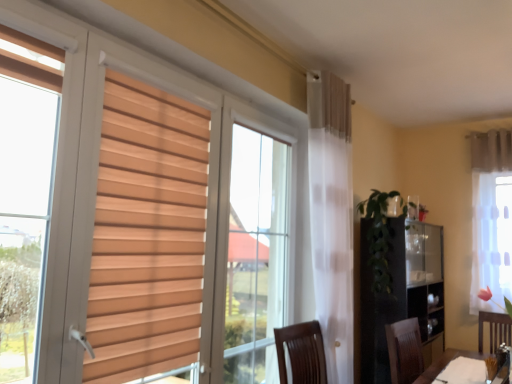
Question: Is green leafy plant at center-right outside white sheer curtain at right, marked as the second curtain in a top-to-bottom arrangement?

Choices:
 (A) yes
 (B) no

Answer: (A)

Question: Is green leafy plant at center-right surrounding white sheer curtain at right, acting as the 1th curtain starting from the bottom?

Choices:
 (A) no
 (B) yes

Answer: (A)

Question: Considering the relative positions of green leafy plant at center-right and white sheer curtain at right, marked as the second curtain in a top-to-bottom arrangement, in the image provided, is green leafy plant at center-right to the left of white sheer curtain at right, marked as the second curtain in a top-to-bottom arrangement, from the viewer's perspective?

Choices:
 (A) no
 (B) yes

Answer: (B)

Question: Is green leafy plant at center-right at the right side of white sheer curtain at right, marked as the second curtain in a top-to-bottom arrangement?

Choices:
 (A) yes
 (B) no

Answer: (B)

Question: Is green leafy plant at center-right far away from white sheer curtain at right, marked as the second curtain in a top-to-bottom arrangement?

Choices:
 (A) no
 (B) yes

Answer: (B)

Question: Does green leafy plant at center-right turn towards white sheer curtain at right, acting as the 1th curtain starting from the bottom?

Choices:
 (A) no
 (B) yes

Answer: (A)

Question: Does white sheer curtain at right, marked as the second curtain in a top-to-bottom arrangement, appear on the left side of white sheer curtain at upper right, positioned as the first curtain in top-to-bottom order?

Choices:
 (A) yes
 (B) no

Answer: (A)

Question: Is white sheer curtain at right, marked as the second curtain in a top-to-bottom arrangement, shorter than white sheer curtain at upper right, the 2th curtain ordered from the bottom?

Choices:
 (A) no
 (B) yes

Answer: (A)

Question: Can you confirm if white sheer curtain at right, acting as the 1th curtain starting from the bottom, is smaller than white sheer curtain at upper right, positioned as the first curtain in top-to-bottom order?

Choices:
 (A) yes
 (B) no

Answer: (B)

Question: Can you confirm if white sheer curtain at right, acting as the 1th curtain starting from the bottom, is bigger than white sheer curtain at upper right, positioned as the first curtain in top-to-bottom order?

Choices:
 (A) yes
 (B) no

Answer: (A)

Question: Can you confirm if white sheer curtain at right, acting as the 1th curtain starting from the bottom, is thinner than white sheer curtain at upper right, positioned as the first curtain in top-to-bottom order?

Choices:
 (A) no
 (B) yes

Answer: (B)

Question: Is the depth of white sheer curtain at right, marked as the second curtain in a top-to-bottom arrangement, greater than that of white sheer curtain at upper right, positioned as the first curtain in top-to-bottom order?

Choices:
 (A) yes
 (B) no

Answer: (B)

Question: From the image's perspective, is white sheer curtain at upper right, the 2th curtain ordered from the bottom, over white sheer curtain at right, acting as the 1th curtain starting from the bottom?

Choices:
 (A) no
 (B) yes

Answer: (B)